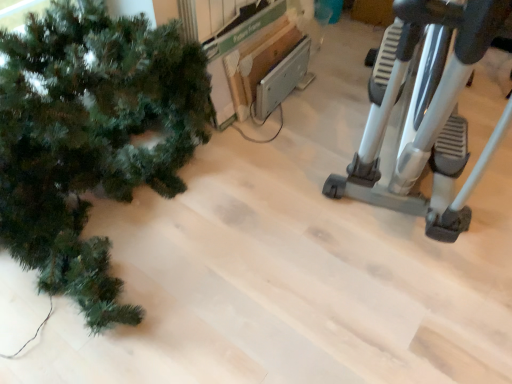
Find the location of a particular element. The height and width of the screenshot is (384, 512). free location to the right of green matte christmas tree at left is located at coordinates (306, 223).